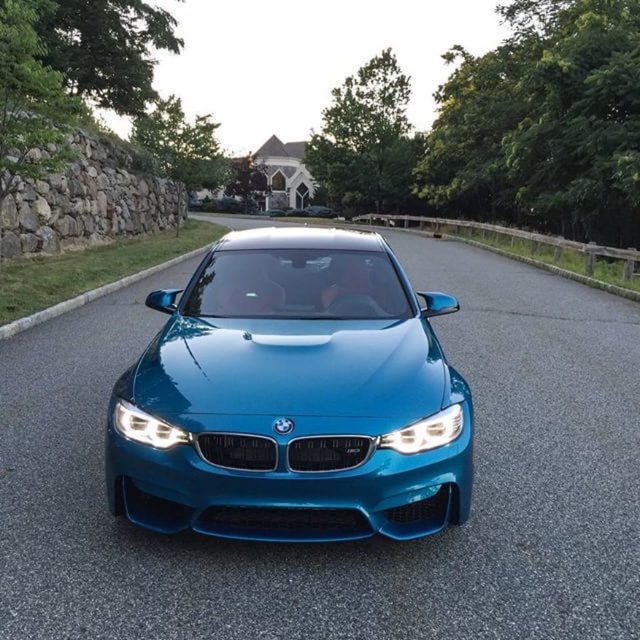
Between point (244, 424) and point (384, 442), which one is positioned behind?

Point (384, 442)

Between point (326, 496) and point (456, 412), which one is positioned in front?

Point (326, 496)

At what (x,y) coordinates should I click in order to perform the action: click on glossy metallic car at center. Please return your answer as a coordinate pair (x, y). The width and height of the screenshot is (640, 640). Looking at the image, I should click on (292, 396).

Who is more forward, (252, 385) or (164, 429)?

Point (164, 429) is in front.

Does glossy metallic car at center have a greater height compared to matte blue headlight at center?

Yes, glossy metallic car at center is taller than matte blue headlight at center.

Describe the element at coordinates (292, 396) in the screenshot. This screenshot has height=640, width=640. I see `glossy metallic car at center` at that location.

This screenshot has width=640, height=640. I want to click on glossy metallic car at center, so click(x=292, y=396).

Between point (378, 440) and point (156, 428), which one is positioned behind?

Positioned behind is point (156, 428).

Is satin chrome headlight at center above matte blue headlight at center?

Actually, satin chrome headlight at center is below matte blue headlight at center.

The height and width of the screenshot is (640, 640). In order to click on satin chrome headlight at center in this screenshot , I will do `click(426, 433)`.

Where is `satin chrome headlight at center`? satin chrome headlight at center is located at coordinates tap(426, 433).